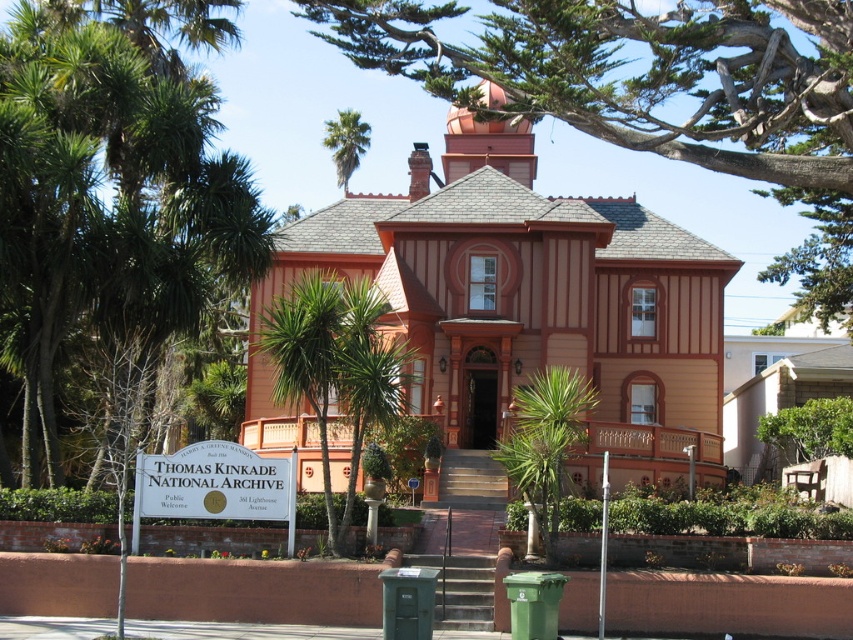
Which is behind, point (27, 198) or point (352, 112)?

Positioned behind is point (352, 112).

Is point (148, 148) more distant than point (363, 122)?

No, it is in front of (363, 122).

Between point (32, 403) and point (367, 134), which one is positioned behind?

Point (367, 134)

Locate an element on the screen. green leafy palm tree at left is located at coordinates (113, 182).

The width and height of the screenshot is (853, 640). What do you see at coordinates (656, 92) in the screenshot?
I see `green leafy tree at upper center` at bounding box center [656, 92].

Measure the distance between green leafy tree at upper center and camera.

green leafy tree at upper center is 58.80 meters from camera.

The width and height of the screenshot is (853, 640). What do you see at coordinates (656, 92) in the screenshot? I see `green leafy tree at upper center` at bounding box center [656, 92].

Image resolution: width=853 pixels, height=640 pixels. Find the location of `green leafy tree at upper center`. green leafy tree at upper center is located at coordinates (656, 92).

Does green leafy palm tree at left have a larger size compared to green leafy tree at upper center?

No, green leafy palm tree at left is not bigger than green leafy tree at upper center.

Does point (86, 96) lie in front of point (640, 92)?

Yes, it is in front of point (640, 92).

Between point (115, 236) and point (814, 291), which one is positioned in front?

Point (115, 236)

I want to click on green leafy palm tree at left, so click(113, 182).